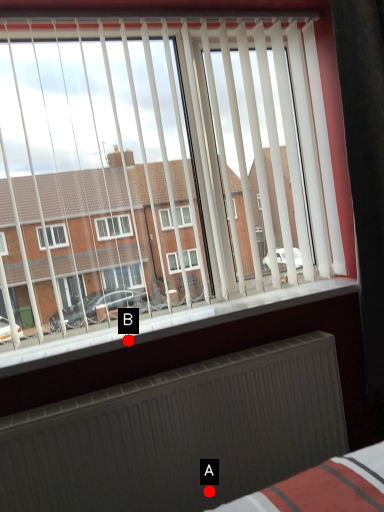
Question: Two points are circled on the image, labeled by A and B beside each circle. Among these points, which one is farthest from the camera?

Choices:
 (A) A is further
 (B) B is further

Answer: (A)